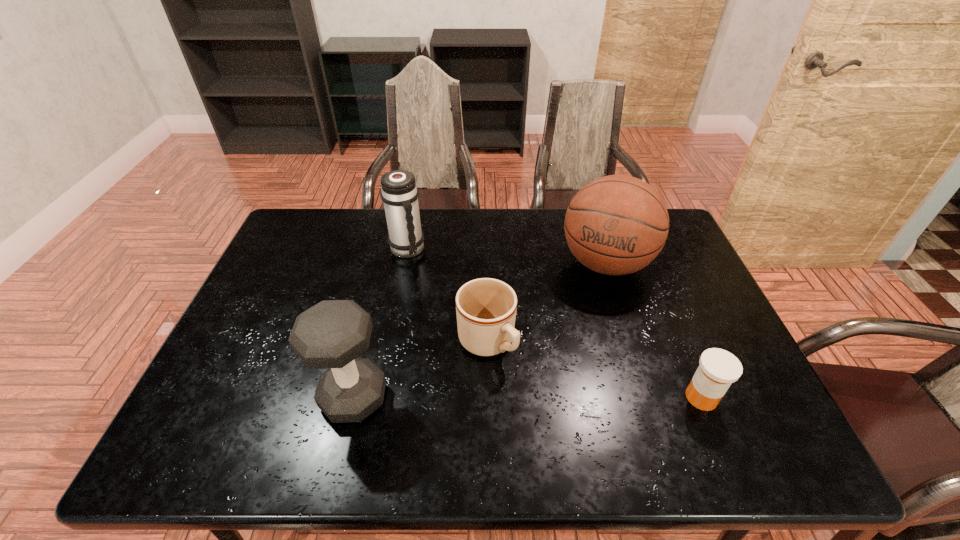
Where is `vacant space at the right edge`? vacant space at the right edge is located at coordinates (698, 294).

The width and height of the screenshot is (960, 540). Identify the location of free spot at the far left corner of the desktop. (332, 221).

Identify the location of vacant area that lies between the dumbbell and the medicine. The height and width of the screenshot is (540, 960). (528, 397).

Locate an element on the screen. free point between the mug and the medicine is located at coordinates (594, 369).

Identify the location of free space between the medicine and the third object from left to right. (594, 369).

I want to click on free spot between the basketball and the thermos bottle, so click(x=506, y=256).

At what (x,y) coordinates should I click in order to perform the action: click on vacant area between the basketball and the medicine. Please return your answer as a coordinate pair (x, y). Looking at the image, I should click on (654, 330).

You are a GUI agent. You are given a task and a screenshot of the screen. Output one action in this format:
    pyautogui.click(x=<x>, y=<y>)
    Task: Click on the free spot between the basketball and the thermos bottle
    The width and height of the screenshot is (960, 540).
    Given the screenshot: What is the action you would take?
    pyautogui.click(x=506, y=256)

The height and width of the screenshot is (540, 960). In order to click on empty space between the thermos bottle and the dumbbell in this screenshot , I will do [380, 323].

What are the coordinates of `free space between the dumbbell and the third object from right to left` in the screenshot? It's located at (420, 369).